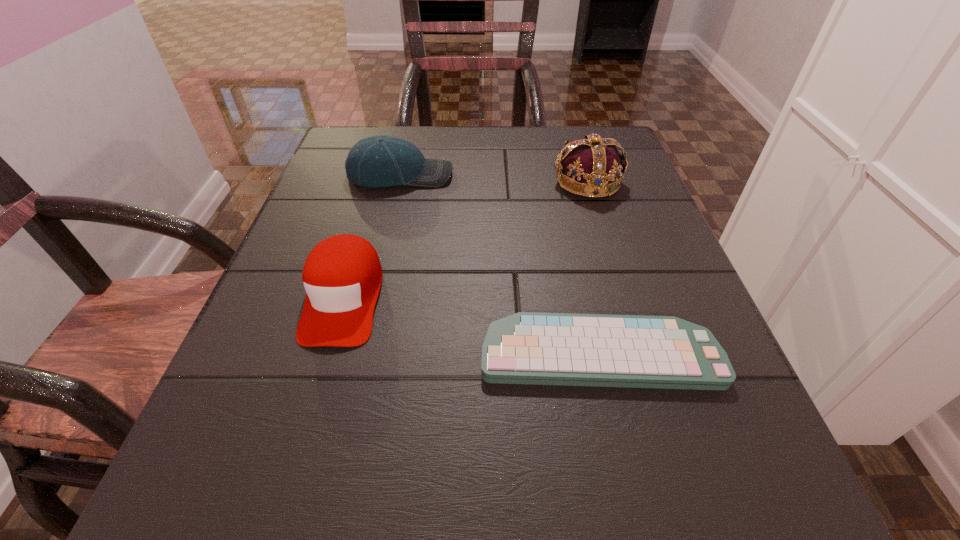
You are a GUI agent. You are given a task and a screenshot of the screen. Output one action in this format:
    pyautogui.click(x=<x>, y=<y>)
    Task: Click on the free space in the image that satisfies the following two spatial constraints: 1. on the front-facing side of the shortest object; 2. on the left side of the nearer baseball cap
    This screenshot has height=540, width=960.
    Given the screenshot: What is the action you would take?
    pyautogui.click(x=327, y=354)

Locate an element on the screen. free spot that satisfies the following two spatial constraints: 1. on the front-facing side of the computer keyboard; 2. on the right side of the nearer baseball cap is located at coordinates (327, 354).

Find the location of a particular element. free location that satisfies the following two spatial constraints: 1. on the front side of the farther baseball cap; 2. on the right side of the computer keyboard is located at coordinates (358, 354).

Image resolution: width=960 pixels, height=540 pixels. Identify the location of free region that satisfies the following two spatial constraints: 1. on the back side of the crown; 2. on the right side of the computer keyboard. [560, 181].